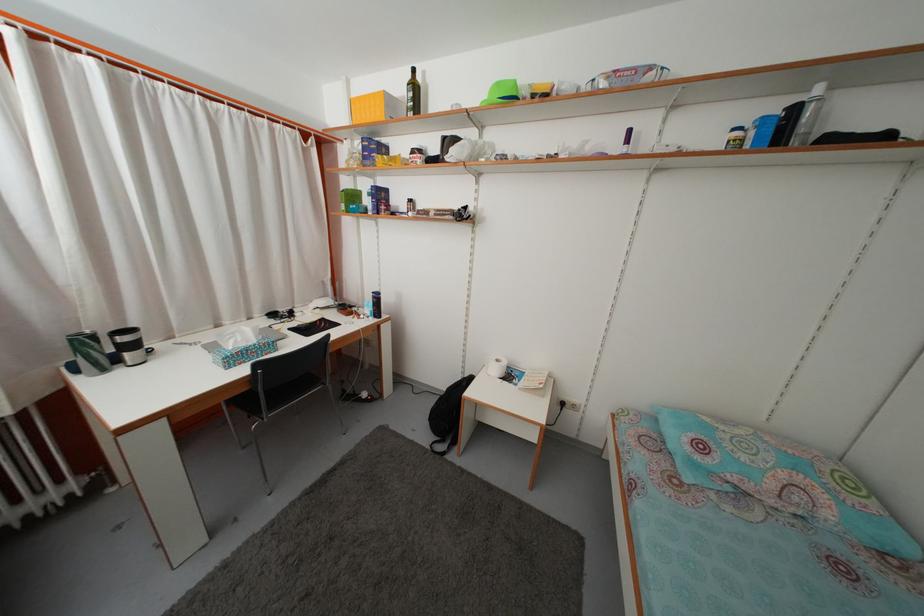
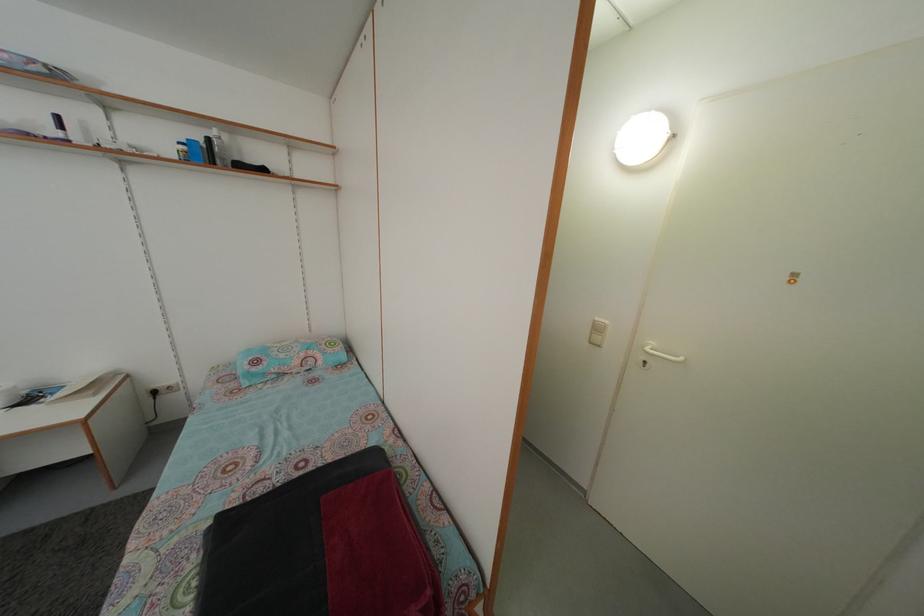
Find the pixel in the second image that matches (800,116) in the first image.

(214, 148)